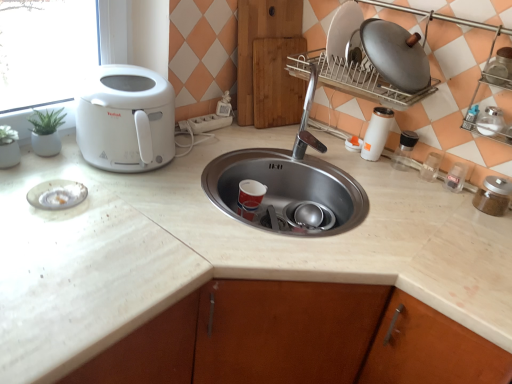
Question: Considering the relative sizes of brown glass jar at right, acting as the first appliance starting from the right, and white plastic soap dispenser at upper right, the 8th appliance viewed from the right, in the image provided, is brown glass jar at right, acting as the first appliance starting from the right, smaller than white plastic soap dispenser at upper right, the 8th appliance viewed from the right,?

Choices:
 (A) no
 (B) yes

Answer: (A)

Question: Considering the relative sizes of brown glass jar at right, the 8th appliance positioned from the left, and white plastic soap dispenser at upper right, the first appliance positioned from the left, in the image provided, is brown glass jar at right, the 8th appliance positioned from the left, taller than white plastic soap dispenser at upper right, the first appliance positioned from the left,?

Choices:
 (A) yes
 (B) no

Answer: (A)

Question: Considering the relative sizes of brown glass jar at right, acting as the first appliance starting from the right, and white plastic soap dispenser at upper right, the 8th appliance viewed from the right, in the image provided, is brown glass jar at right, acting as the first appliance starting from the right, thinner than white plastic soap dispenser at upper right, the 8th appliance viewed from the right,?

Choices:
 (A) yes
 (B) no

Answer: (B)

Question: From a real-world perspective, is brown glass jar at right, acting as the first appliance starting from the right, under white plastic soap dispenser at upper right, the 8th appliance viewed from the right?

Choices:
 (A) no
 (B) yes

Answer: (A)

Question: Is brown glass jar at right, acting as the first appliance starting from the right, to the left of white plastic soap dispenser at upper right, the first appliance positioned from the left, from the viewer's perspective?

Choices:
 (A) no
 (B) yes

Answer: (A)

Question: From a real-world perspective, is white marble countertop at center physically located above or below transparent plastic container at right, the fourth appliance in the left-to-right sequence?

Choices:
 (A) below
 (B) above

Answer: (A)

Question: From their relative heights in the image, would you say white marble countertop at center is taller or shorter than transparent plastic container at right, which is counted as the 5th appliance, starting from the right?

Choices:
 (A) short
 (B) tall

Answer: (B)

Question: Is point (62, 281) positioned closer to the camera than point (436, 167)?

Choices:
 (A) closer
 (B) farther

Answer: (A)

Question: In terms of width, does white marble countertop at center look wider or thinner when compared to transparent plastic container at right, the fourth appliance in the left-to-right sequence?

Choices:
 (A) wide
 (B) thin

Answer: (A)

Question: Is white plastic toaster at left wider or thinner than satin silver jar at right, which is the seventh appliance in left-to-right order?

Choices:
 (A) wide
 (B) thin

Answer: (A)

Question: Is white plastic toaster at left inside or outside of satin silver jar at right, the second appliance when ordered from right to left?

Choices:
 (A) inside
 (B) outside

Answer: (B)

Question: From the image's perspective, is white plastic toaster at left located above or below satin silver jar at right, the second appliance when ordered from right to left?

Choices:
 (A) above
 (B) below

Answer: (A)

Question: Does point tap(95, 145) appear closer or farther from the camera than point tap(500, 129)?

Choices:
 (A) closer
 (B) farther

Answer: (A)

Question: Looking at the image, does white glossy thermos at right, the seventh appliance positioned from the right, seem bigger or smaller compared to clear plastic container at right, which is the 4th appliance from right to left?

Choices:
 (A) big
 (B) small

Answer: (A)

Question: From their relative heights in the image, would you say white glossy thermos at right, the seventh appliance positioned from the right, is taller or shorter than clear plastic container at right, arranged as the fifth appliance when viewed from the left?

Choices:
 (A) short
 (B) tall

Answer: (B)